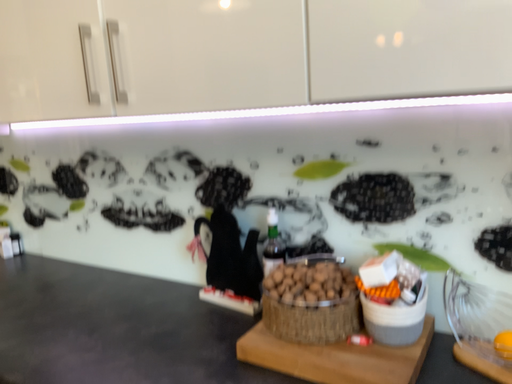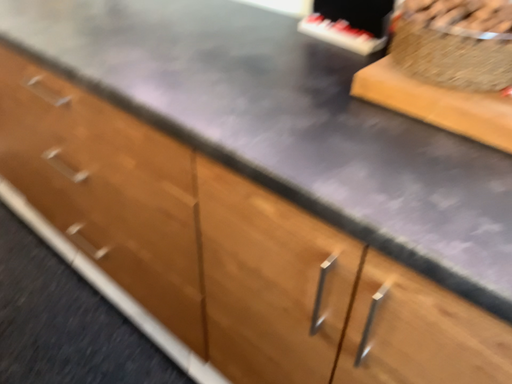
Question: Which way did the camera rotate in the video?

Choices:
 (A) rotated downward
 (B) rotated upward

Answer: (A)